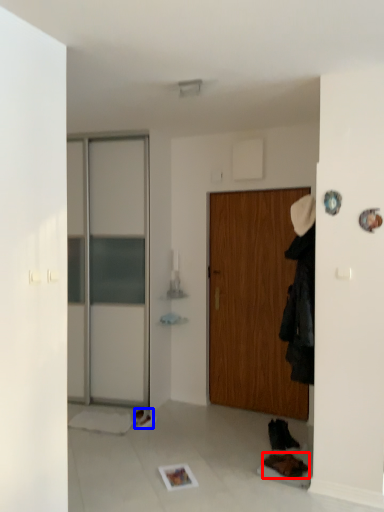
Question: Which object is further to the camera taking this photo, shoe (highlighted by a red box) or shoe (highlighted by a blue box)?

Choices:
 (A) shoe
 (B) shoe

Answer: (B)